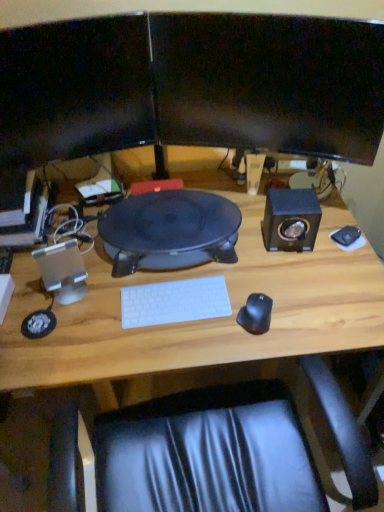
Where is `vacant space that is in between black rubberized mouse at right, the 1th mouse when ordered from front to back, and white plastic keyboard at center`? vacant space that is in between black rubberized mouse at right, the 1th mouse when ordered from front to back, and white plastic keyboard at center is located at coordinates click(x=210, y=321).